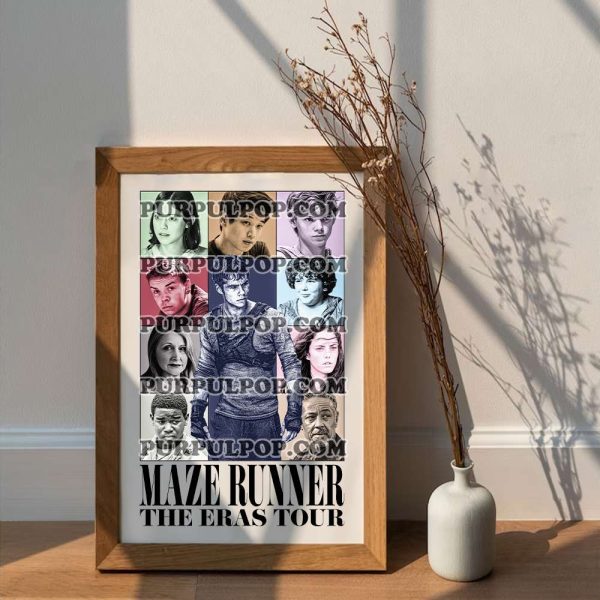
You are a GUI agent. You are given a task and a screenshot of the screen. Output one action in this format:
    pyautogui.click(x=<x>, y=<y>)
    Task: Click on the vase
    
    Given the screenshot: What is the action you would take?
    pyautogui.click(x=474, y=532)